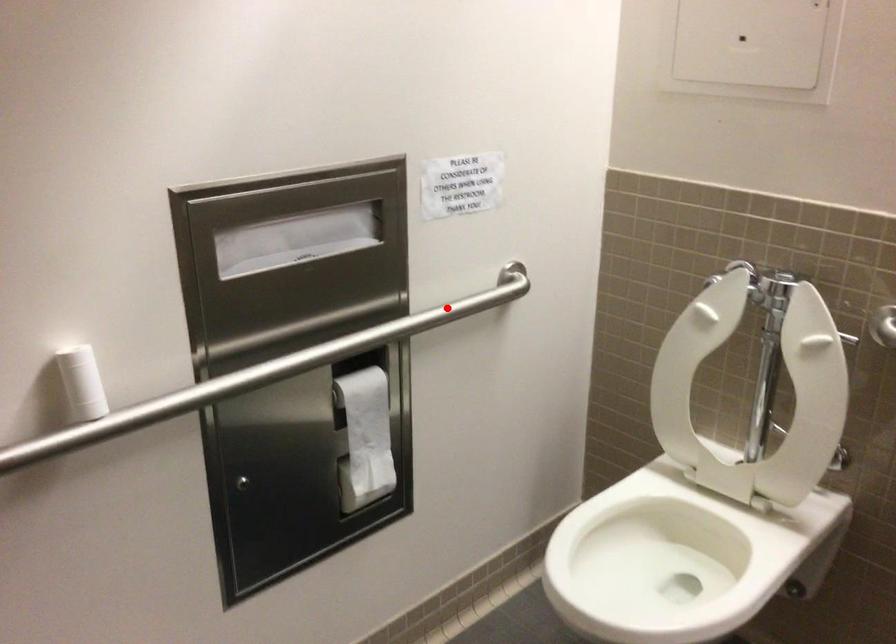
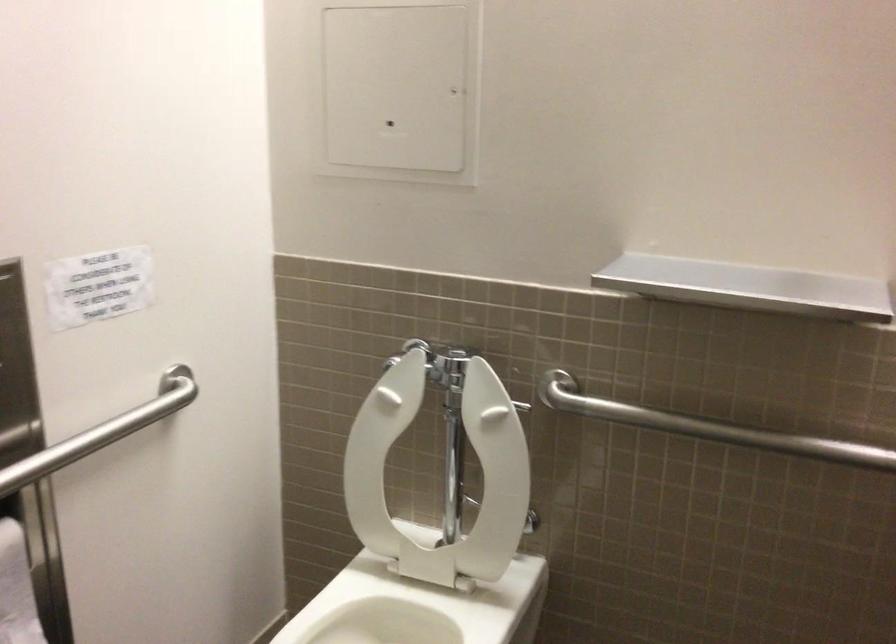
Question: I am providing you with two images of the same scene from different viewpoints. In image1, a red point is highlighted. Considering the same 3D point in image2, which of the following is correct?

Choices:
 (A) It is closer
 (B) It is farther

Answer: (A)